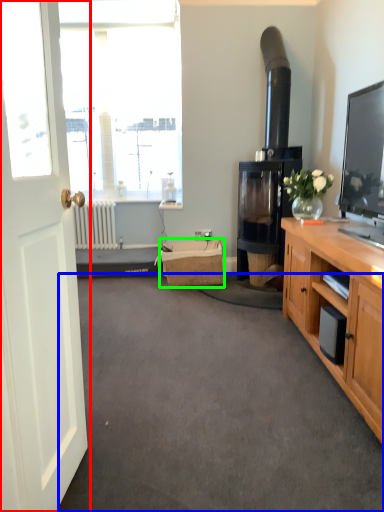
Question: Which is farther away from door (highlighted by a red box)? plain (highlighted by a blue box) or picnic basket (highlighted by a green box)?

Choices:
 (A) plain
 (B) picnic basket

Answer: (B)